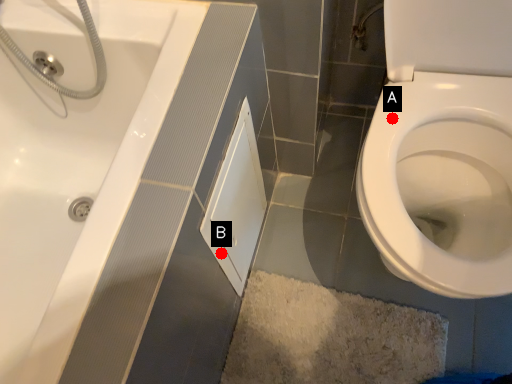
Question: Two points are circled on the image, labeled by A and B beside each circle. Among these points, which one is farthest from the camera?

Choices:
 (A) A is further
 (B) B is further

Answer: (B)